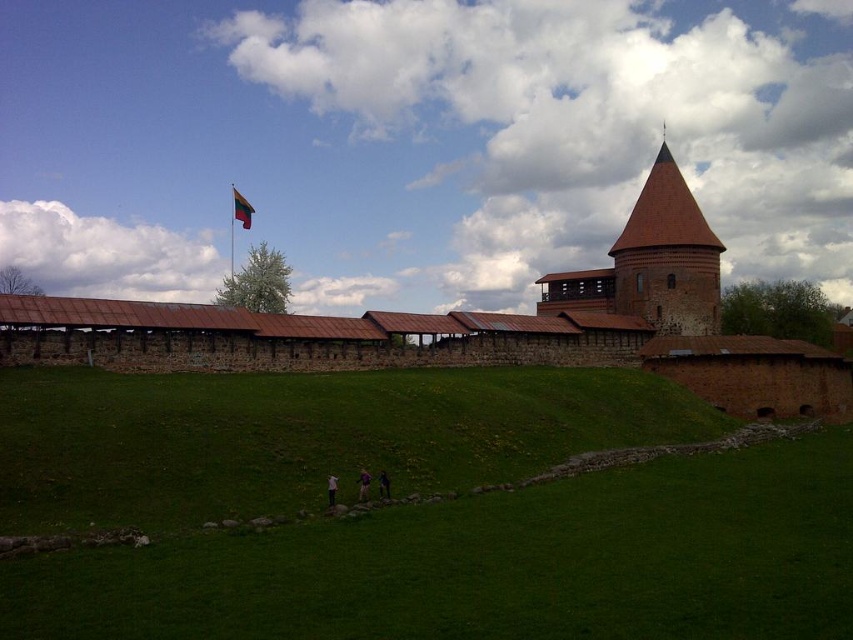
Can you confirm if green grassy hill at lower center is smaller than dark blue jeans at lower center?

No, green grassy hill at lower center is not smaller than dark blue jeans at lower center.

Who is more distant from viewer, (x=457, y=515) or (x=389, y=496)?

Positioned behind is point (x=389, y=496).

This screenshot has width=853, height=640. I want to click on green grassy hill at lower center, so click(x=495, y=563).

Who is positioned more to the left, brown stone castle at center or purple fabric at lower center?

purple fabric at lower center

From the picture: Does brown stone castle at center have a larger size compared to purple fabric at lower center?

Correct, brown stone castle at center is larger in size than purple fabric at lower center.

You are a GUI agent. You are given a task and a screenshot of the screen. Output one action in this format:
    pyautogui.click(x=<x>, y=<y>)
    Task: Click on the brown stone castle at center
    This screenshot has width=853, height=640.
    Given the screenshot: What is the action you would take?
    pyautogui.click(x=479, y=326)

Locate an element on the screen. This screenshot has width=853, height=640. brown stone castle at center is located at coordinates (479, 326).

Can you confirm if brown stone castle at center is smaller than dark blue jeans at lower center?

No, brown stone castle at center is not smaller than dark blue jeans at lower center.

This screenshot has width=853, height=640. What do you see at coordinates (479, 326) in the screenshot? I see `brown stone castle at center` at bounding box center [479, 326].

Identify the location of brown stone castle at center. (479, 326).